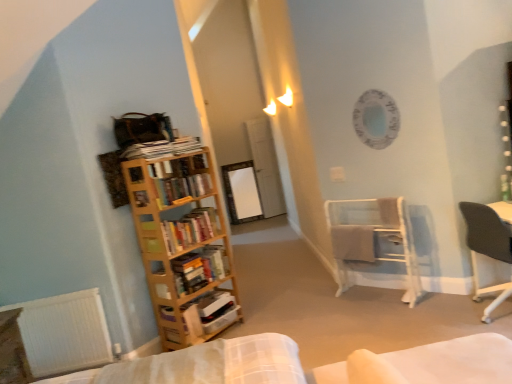
The width and height of the screenshot is (512, 384). In order to click on vacant area on top of white matte radiator at lower left (from a real-world perspective) in this screenshot , I will do `click(44, 300)`.